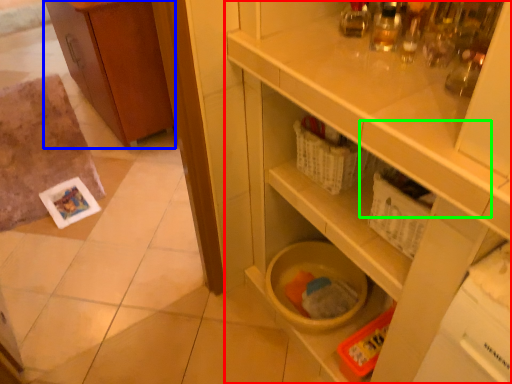
Question: Considering the real-world distances, which object is farthest from cupboard (highlighted by a red box)? cabinetry (highlighted by a blue box) or drawer (highlighted by a green box)?

Choices:
 (A) cabinetry
 (B) drawer

Answer: (A)